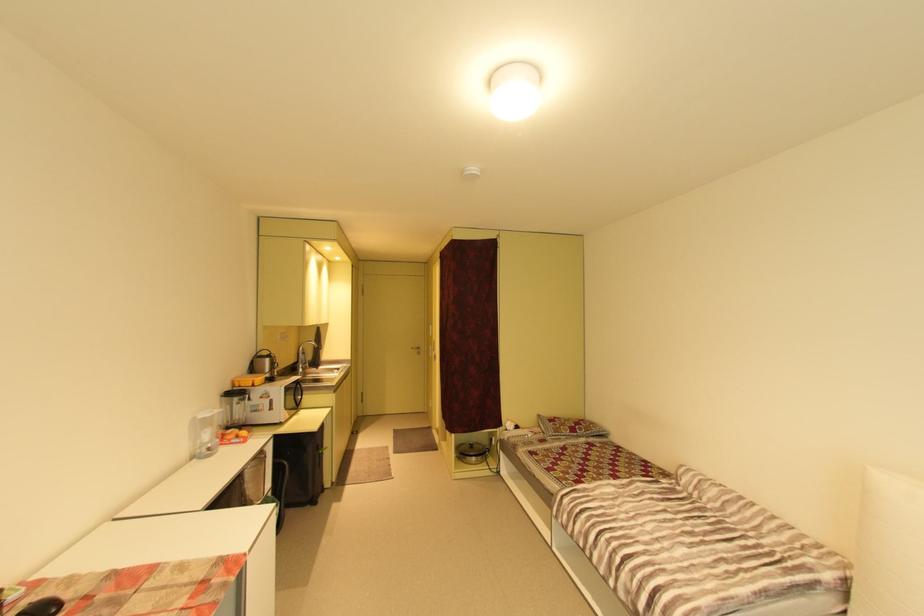
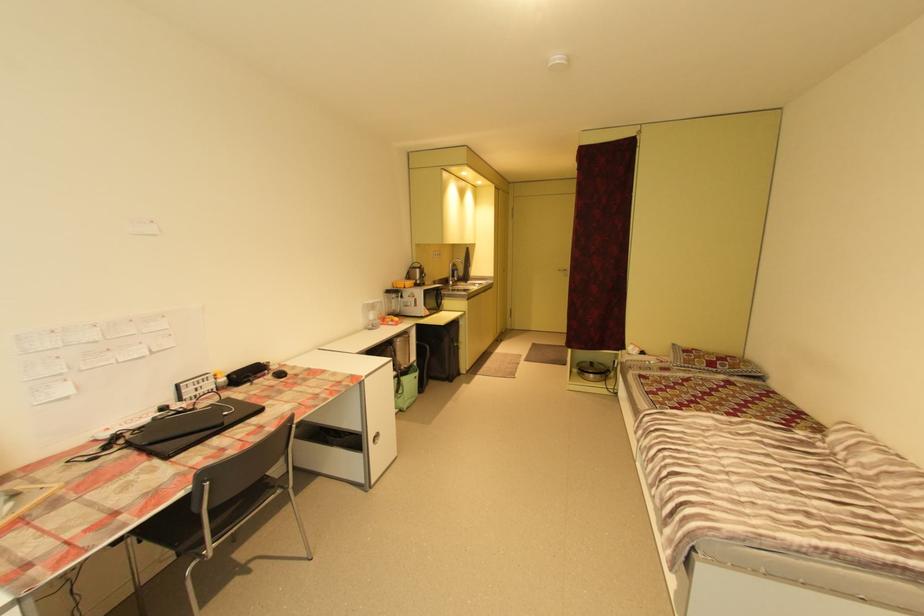
Question: How did the camera likely rotate?

Choices:
 (A) Left
 (B) Right
 (C) Up
 (D) Down

Answer: (A)